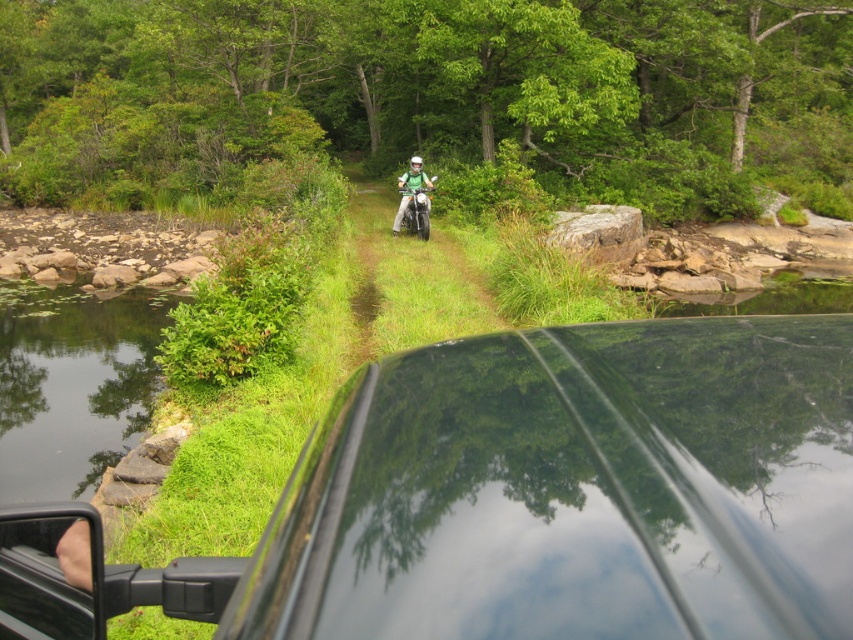
Question: Where is glossy black car at center located in relation to green matte motorcycle at center in the image?

Choices:
 (A) left
 (B) right

Answer: (B)

Question: Is the position of glossy black car at center more distant than that of green matte motorcycle at center?

Choices:
 (A) yes
 (B) no

Answer: (B)

Question: Which of the following is the farthest from the observer?

Choices:
 (A) green matte motorcycle at center
 (B) glossy black car at center

Answer: (A)

Question: Is glossy black car at center closer to camera compared to green matte motorcycle at center?

Choices:
 (A) no
 (B) yes

Answer: (B)

Question: Which point appears farthest from the camera in this image?

Choices:
 (A) (415, 182)
 (B) (490, 540)

Answer: (A)